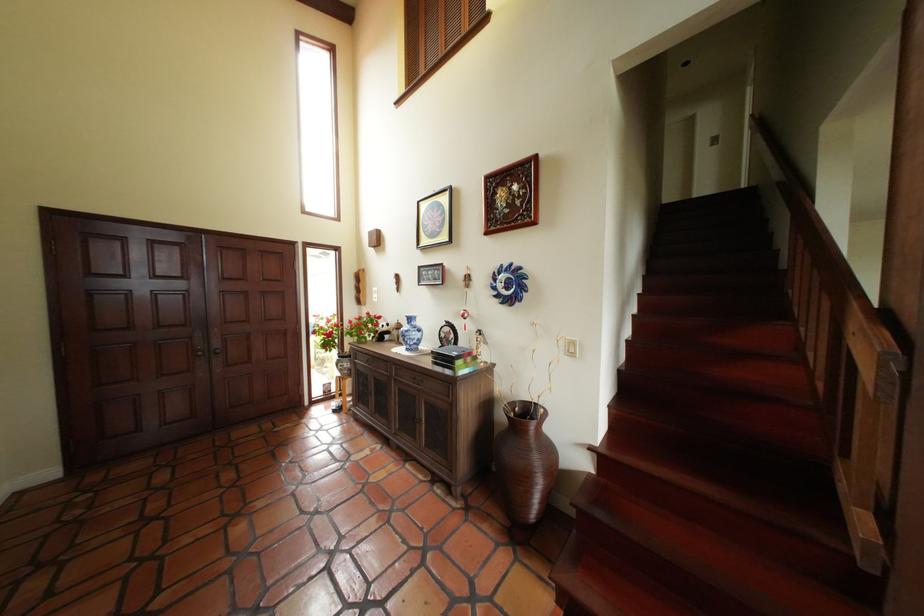
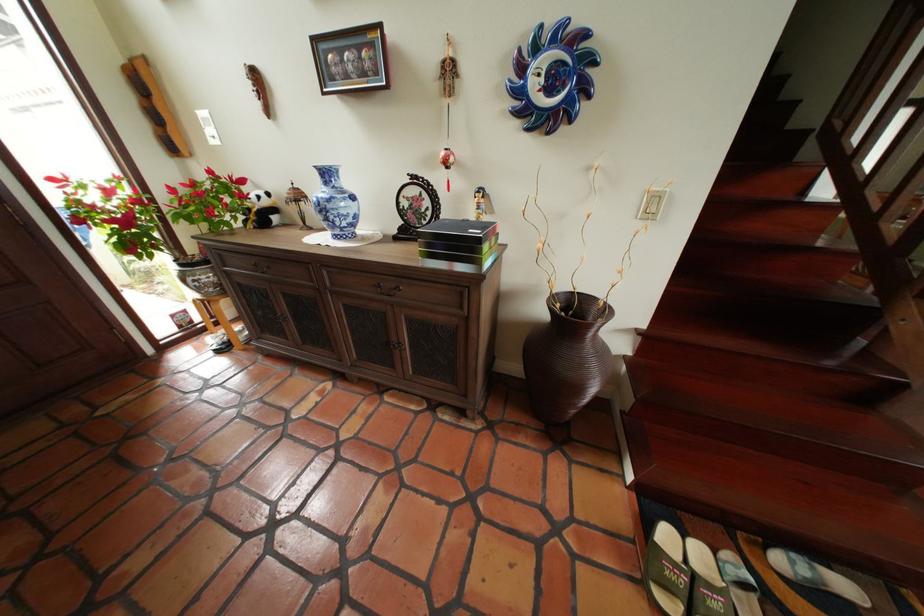
The point at (418, 338) is marked in the first image. Where is the corresponding point in the second image?

(341, 214)